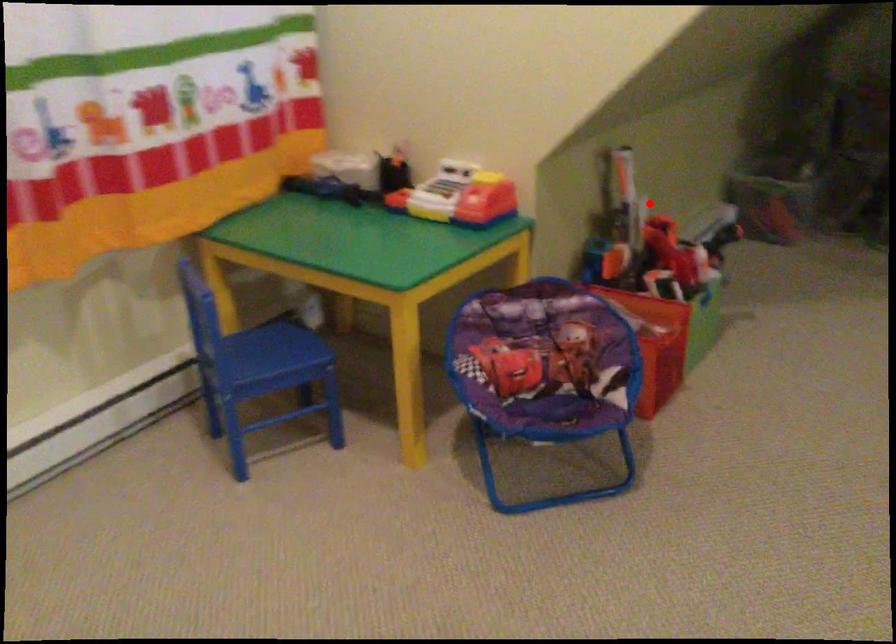
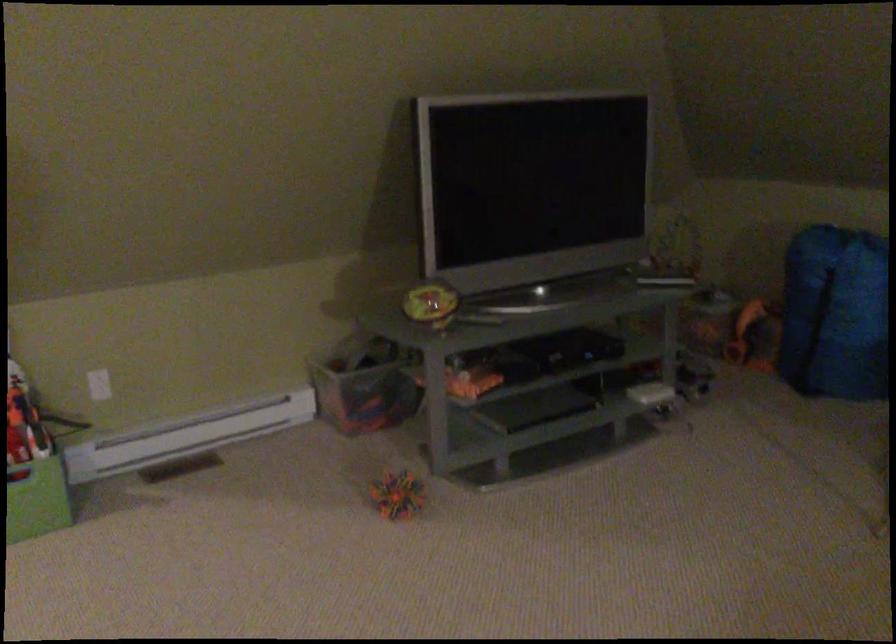
The point at the highlighted location is marked in the first image. Where is the corresponding point in the second image?

(99, 384)